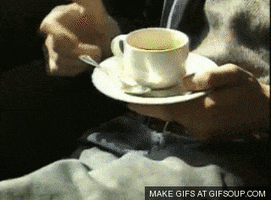
The width and height of the screenshot is (271, 200). Find the location of `silver spoon`. silver spoon is located at coordinates (131, 87).